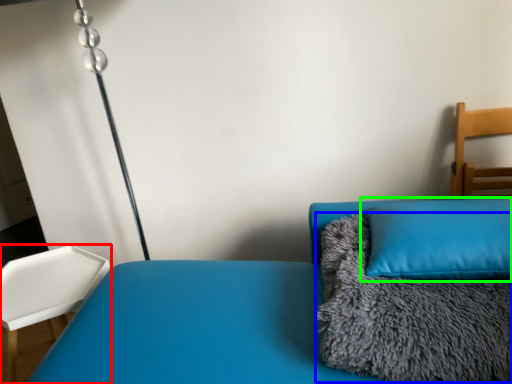
Question: Based on their relative distances, which object is nearer to furniture (highlighted by a red box)? Choose from blanket (highlighted by a blue box) and pillow (highlighted by a green box).

Choices:
 (A) blanket
 (B) pillow

Answer: (A)